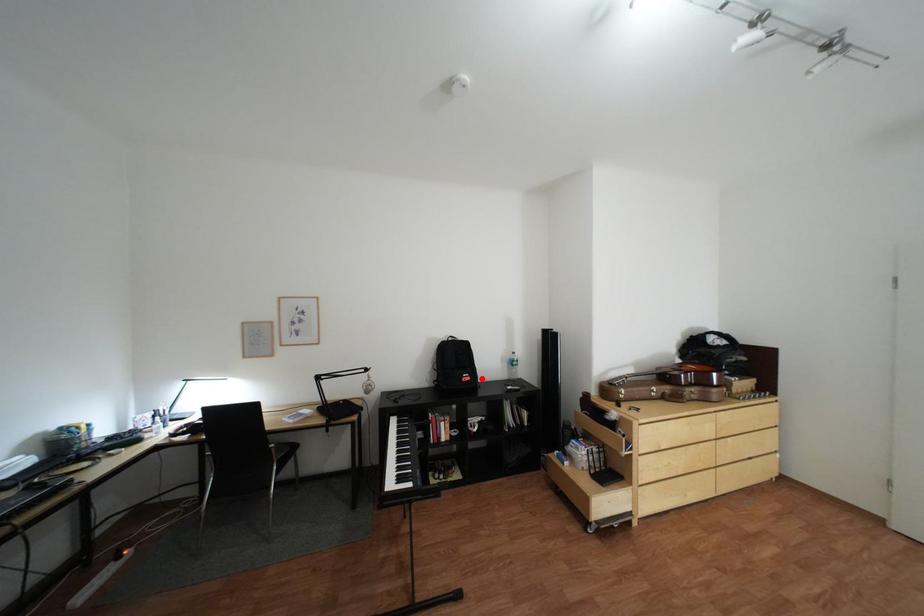
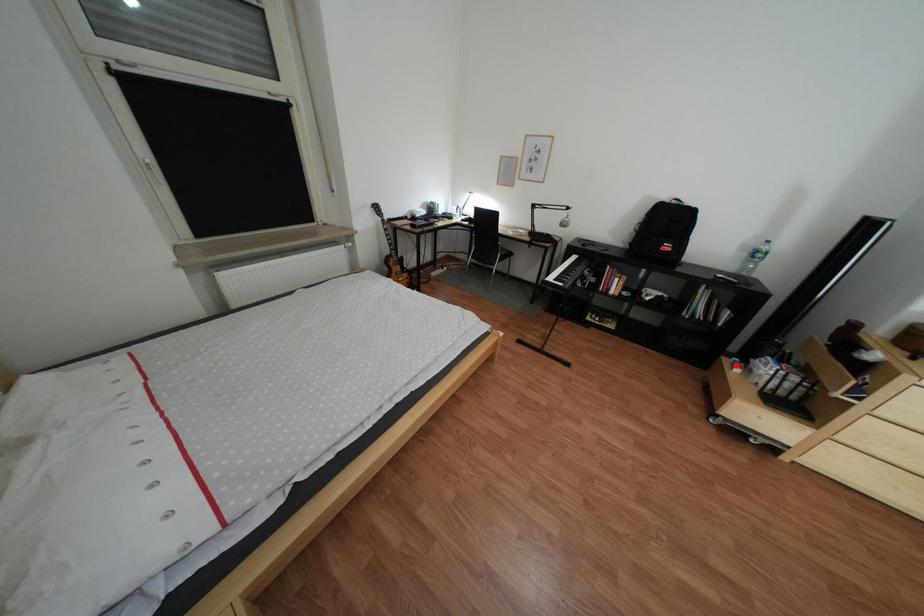
I am providing you with two images of the same scene from different viewpoints. A red point is marked on the first image and another point is marked on the second image. Is the marked point in image1 the same physical position as the marked point in image2?

No